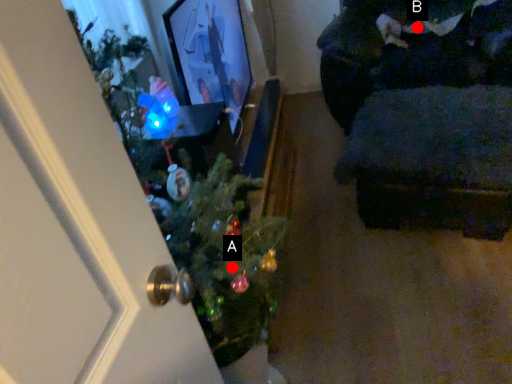
Question: Two points are circled on the image, labeled by A and B beside each circle. Which point is closer to the camera?

Choices:
 (A) A is closer
 (B) B is closer

Answer: (A)